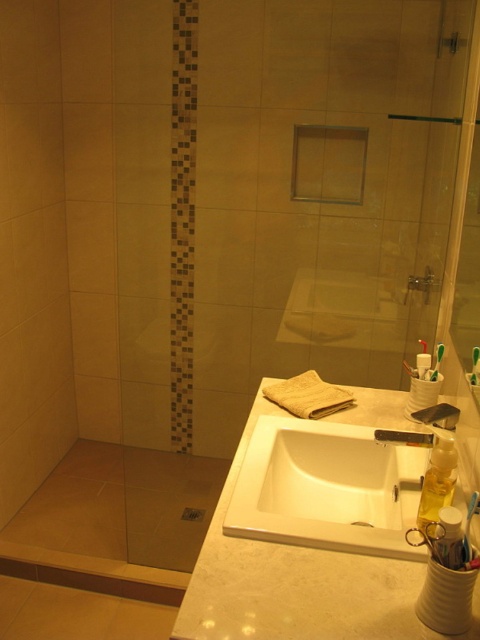
From the picture: You are standing in the bathroom and want to wash your hands. Which sink should you use, the white marble sink at center or the white glossy sink at center?

You should use the white marble sink at center because it is in front of the white glossy sink at center, making it the accessible one.

You are a bathroom designer trying to place a new decorative item between the white marble sink at center and the white glossy sink at center. Given the distance between them is 7.97 centimeters, can you fit a 10 centimeter wide decorative item in between?

The distance between the white marble sink at center and the white glossy sink at center is 7.97 centimeters, so the 10 centimeter wide decorative item cannot fit in between as it is wider than the available space.

You are standing in the bathroom and want to reach both the point at coordinates (237, 534) and the point at coordinates (415, 445). Which point will you reach first?

You will reach the point at coordinates (237, 534) first because it is closer to you than the point at coordinates (415, 445).